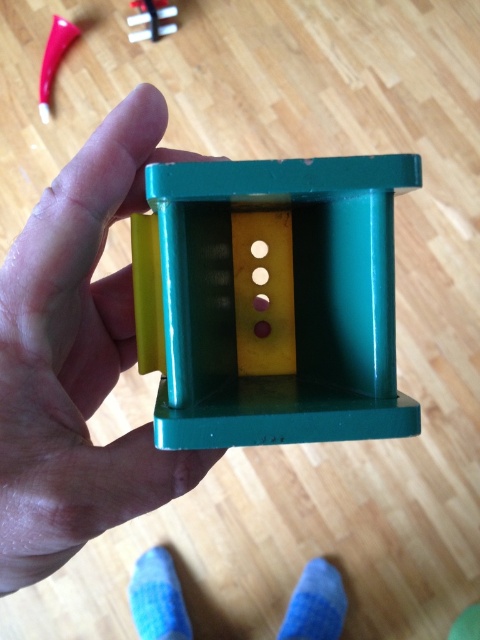
You are a child who wants to grab the green plastic hand at center. If your hand is 7 inches long, can you reach it?

The green plastic hand at center and viewer are 13.76 inches apart. Since your hand is 7 inches long, you cannot reach it as your hand length is shorter than the distance required.

You are a robot trying to pick up the blue fuzzy sock at lower left. The green plastic hand at center is in your way. Can you move around it to reach the sock?

The green plastic hand at center is 1.10 meters away from the blue fuzzy sock at lower left. Since the distance is sufficient, you can move around the green plastic hand at center to reach the blue fuzzy sock at lower left.